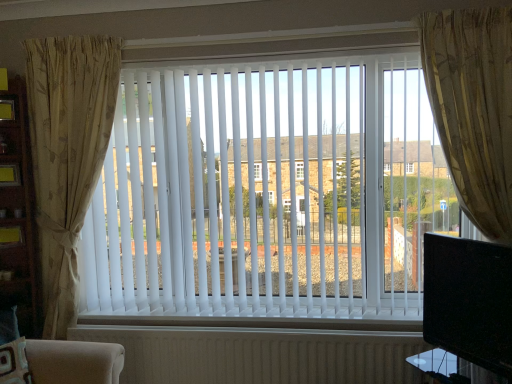
Question: Is beige floral fabric curtain at left, which ranks as the 2th curtain in right-to-left order, in front of or behind white plastic blinds at center in the image?

Choices:
 (A) behind
 (B) front

Answer: (A)

Question: From a real-world perspective, is beige floral fabric curtain at left, which ranks as the 2th curtain in right-to-left order, above or below white plastic blinds at center?

Choices:
 (A) below
 (B) above

Answer: (A)

Question: Considering the real-world distances, which object is farthest from the beige floral fabric curtain at left, which ranks as the 2th curtain in right-to-left order?

Choices:
 (A) white plastic blinds at center
 (B) white ribbed radiator at bottom
 (C) black glossy tv at right
 (D) gold textured curtain at right, marked as the first curtain in a right-to-left arrangement

Answer: (C)

Question: Considering the real-world distances, which object is closest to the gold textured curtain at right, marked as the first curtain in a right-to-left arrangement?

Choices:
 (A) beige floral fabric curtain at left, which is the 1th curtain from left to right
 (B) white ribbed radiator at bottom
 (C) white plastic blinds at center
 (D) black glossy tv at right

Answer: (D)